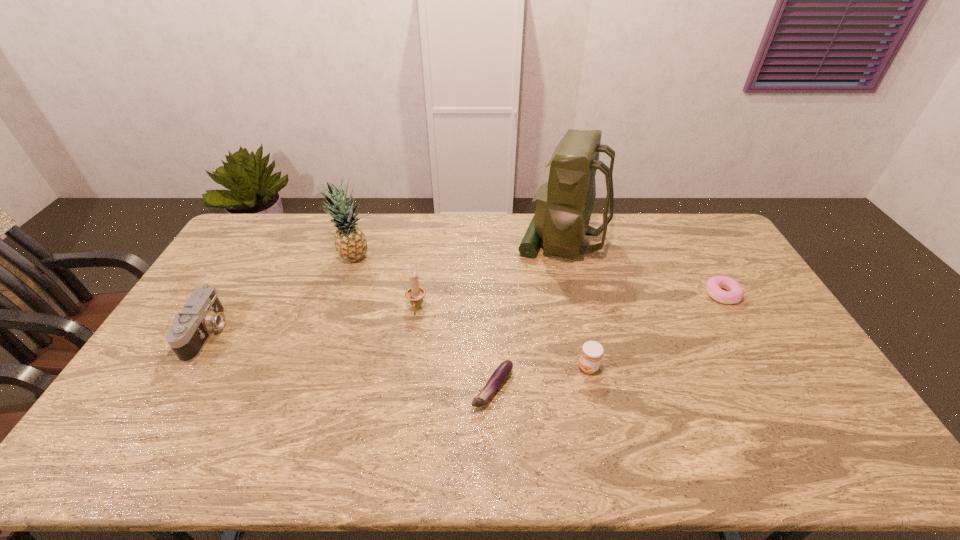
Image resolution: width=960 pixels, height=540 pixels. Find the location of `vacant space located 0.090m on the front of the backpack with visible pockets`. vacant space located 0.090m on the front of the backpack with visible pockets is located at coordinates (492, 239).

The width and height of the screenshot is (960, 540). In order to click on vacant area situated on the front of the backpack with visible pockets in this screenshot , I will do `click(503, 239)`.

Find the location of a particular element. The height and width of the screenshot is (540, 960). vacant region located on the front of the backpack with visible pockets is located at coordinates (490, 239).

I want to click on vacant space located 0.220m on the front of the pineapple, so click(x=334, y=314).

Where is `vacant region located on the handle side of the fifth object from right to left`? This screenshot has height=540, width=960. vacant region located on the handle side of the fifth object from right to left is located at coordinates (403, 404).

Locate an element on the screen. free space located 0.190m on the lens of the camera is located at coordinates (286, 333).

Where is `vacant area located 0.370m on the front label of the fifth tallest object`? vacant area located 0.370m on the front label of the fifth tallest object is located at coordinates (446, 368).

Identify the location of vacant space located on the front label of the fifth tallest object. tap(450, 368).

Image resolution: width=960 pixels, height=540 pixels. In order to click on vacant space located 0.250m on the front label of the fifth tallest object in this screenshot , I will do `click(489, 368)`.

At what (x,y) coordinates should I click in order to perform the action: click on free location located on the front of the rightmost object. Please return your answer as a coordinate pair (x, y). Image resolution: width=960 pixels, height=540 pixels. Looking at the image, I should click on pyautogui.click(x=795, y=419).